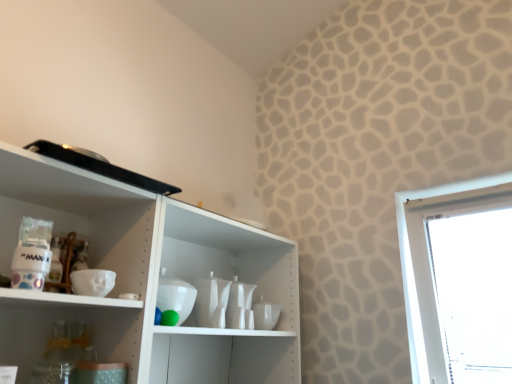
Question: Should I look upward or downward to see white glossy cup at center, which is the 1th tableware from right to left?

Choices:
 (A) up
 (B) down

Answer: (B)

Question: Is white glossy vase at center, which is the second tableware from back to front, in contact with white glossy cup at center, which is the 1th tableware from right to left?

Choices:
 (A) no
 (B) yes

Answer: (A)

Question: Is white glossy vase at center, acting as the second tableware starting from the right, smaller than white glossy cup at center, which is the 1th tableware from right to left?

Choices:
 (A) no
 (B) yes

Answer: (A)

Question: Would you consider white glossy vase at center, acting as the second tableware starting from the right, to be distant from white glossy cup at center, the first tableware viewed from the back?

Choices:
 (A) yes
 (B) no

Answer: (B)

Question: From the image's perspective, is white glossy vase at center, which is the second tableware from back to front, located above white glossy cup at center, the 2th tableware in the front-to-back sequence?

Choices:
 (A) yes
 (B) no

Answer: (A)

Question: Is white glossy vase at center, acting as the 1th tableware starting from the front, shorter than white glossy cup at center, the 2th tableware in the front-to-back sequence?

Choices:
 (A) yes
 (B) no

Answer: (B)

Question: Is the position of white glossy vase at center, acting as the 1th tableware starting from the front, more distant than that of white glossy cup at center, the first tableware viewed from the back?

Choices:
 (A) yes
 (B) no

Answer: (B)

Question: From a real-world perspective, is white glossy cup at center, the second tableware viewed from the left, physically below white glossy vase at center, acting as the second tableware starting from the right?

Choices:
 (A) yes
 (B) no

Answer: (A)

Question: Can you confirm if white glossy cup at center, which is the 1th tableware from right to left, is shorter than white glossy vase at center, marked as the first tableware in a left-to-right arrangement?

Choices:
 (A) no
 (B) yes

Answer: (B)

Question: Can you confirm if white glossy cup at center, the second tableware viewed from the left, is bigger than white glossy vase at center, acting as the 1th tableware starting from the front?

Choices:
 (A) no
 (B) yes

Answer: (A)

Question: Could you tell me if white glossy cup at center, the first tableware viewed from the back, is turned towards white glossy vase at center, acting as the second tableware starting from the right?

Choices:
 (A) yes
 (B) no

Answer: (B)

Question: Considering the relative sizes of white glossy cup at center, the first tableware viewed from the back, and white glossy vase at center, acting as the 1th tableware starting from the front, in the image provided, is white glossy cup at center, the first tableware viewed from the back, wider than white glossy vase at center, acting as the 1th tableware starting from the front,?

Choices:
 (A) yes
 (B) no

Answer: (B)

Question: Are white glossy cup at center, the 2th tableware in the front-to-back sequence, and white glossy vase at center, marked as the first tableware in a left-to-right arrangement, making contact?

Choices:
 (A) no
 (B) yes

Answer: (A)

Question: Is white glossy vase at center, which is the second tableware from back to front, bigger or smaller than white glossy cup at center, the second tableware viewed from the left?

Choices:
 (A) small
 (B) big

Answer: (B)